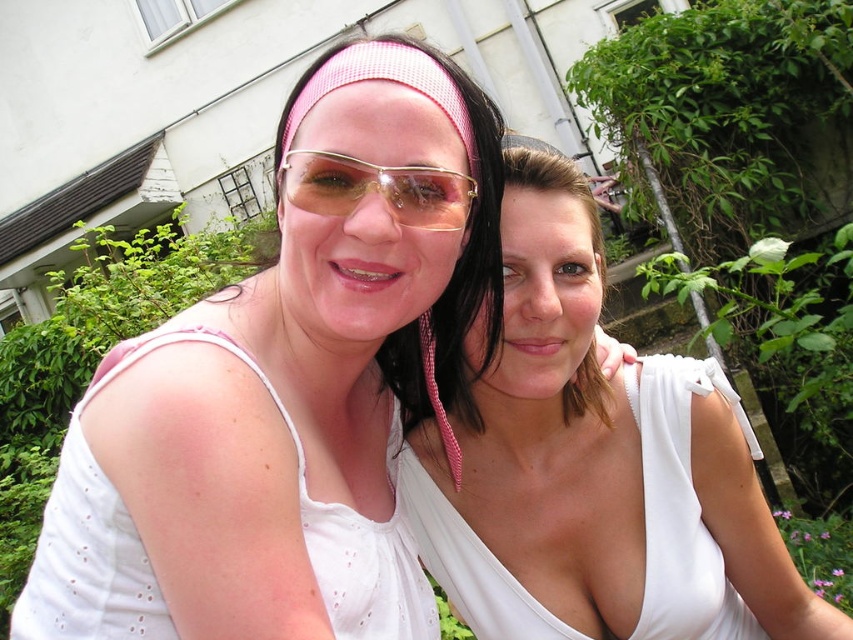
Question: Can you confirm if white fabric dress at center is positioned above gold metallic sunglasses at center?

Choices:
 (A) no
 (B) yes

Answer: (A)

Question: Which object appears closest to the camera in this image?

Choices:
 (A) white silky dress at center
 (B) pink mesh headband at center
 (C) gold metallic sunglasses at center

Answer: (C)

Question: In this image, where is white fabric dress at center located relative to white silky dress at center?

Choices:
 (A) right
 (B) left

Answer: (B)

Question: Among these points, which one is nearest to the camera?

Choices:
 (A) (311, 164)
 (B) (518, 618)
 (C) (751, 488)
 (D) (151, 595)

Answer: (D)

Question: Does white fabric dress at center appear under white lace dress at upper left?

Choices:
 (A) yes
 (B) no

Answer: (B)

Question: Which object is closer to the camera taking this photo?

Choices:
 (A) pink mesh headband at center
 (B) white silky dress at center
 (C) gold metallic sunglasses at center

Answer: (C)